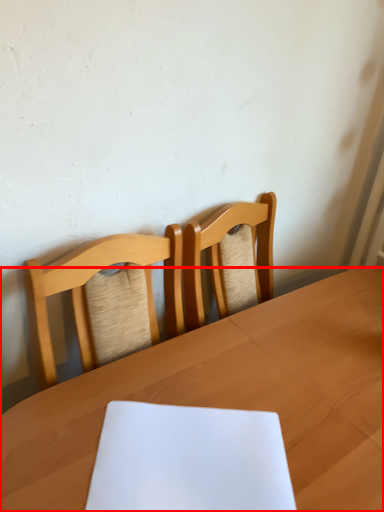
Question: From the image's perspective, where is table (annotated by the red box) located in relation to notebook in the image?

Choices:
 (A) below
 (B) above

Answer: (A)